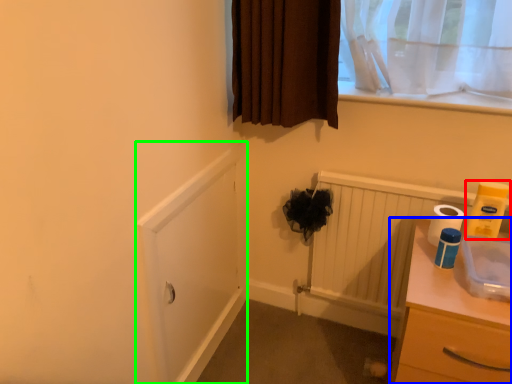
Question: Considering the real-world distances, which object is farthest from toilet paper (highlighted by a red box)? chest of drawers (highlighted by a blue box) or screen door (highlighted by a green box)?

Choices:
 (A) chest of drawers
 (B) screen door

Answer: (B)